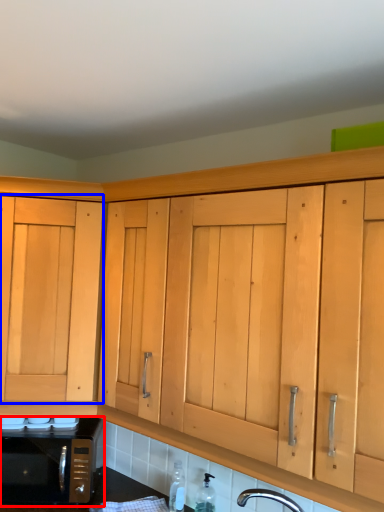
Question: Among these objects, which one is farthest to the camera, microwave oven (highlighted by a red box) or cabinetry (highlighted by a blue box)?

Choices:
 (A) microwave oven
 (B) cabinetry

Answer: (A)